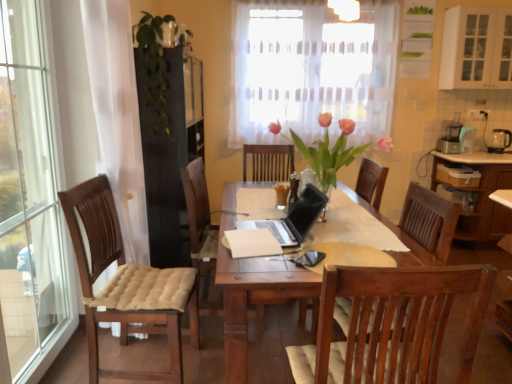
Question: Is wooden cabinet at right, the 1th cabinetry when ordered from bottom to top, wider or thinner than translucent fabric curtain at upper center?

Choices:
 (A) thin
 (B) wide

Answer: (B)

Question: From a real-world perspective, is wooden cabinet at right, positioned as the second cabinetry in top-to-bottom order, positioned above or below translucent fabric curtain at upper center?

Choices:
 (A) below
 (B) above

Answer: (A)

Question: Based on their relative distances, which object is farther from the white matte cabinet at upper right, which ranks as the first cabinetry in top-to-bottom order?

Choices:
 (A) translucent fabric curtain at upper center
 (B) green leafy plant at upper left, the 2th floral arrangement in the front-to-back sequence
 (C) pink glass vase at center, the 2th floral arrangement in the back-to-front sequence
 (D) black matte laptop at center
 (E) black glass kettle at right

Answer: (D)

Question: Estimate the real-world distances between objects in this image. Which object is farther from the pink glass vase at center, the 2th floral arrangement in the back-to-front sequence?

Choices:
 (A) green leafy plant at upper left, the 2th floral arrangement in the front-to-back sequence
 (B) wooden cabinet at right, the 1th cabinetry when ordered from bottom to top
 (C) black glass kettle at right
 (D) translucent fabric curtain at upper center
 (E) white matte cabinet at upper right, which ranks as the first cabinetry in top-to-bottom order

Answer: (C)